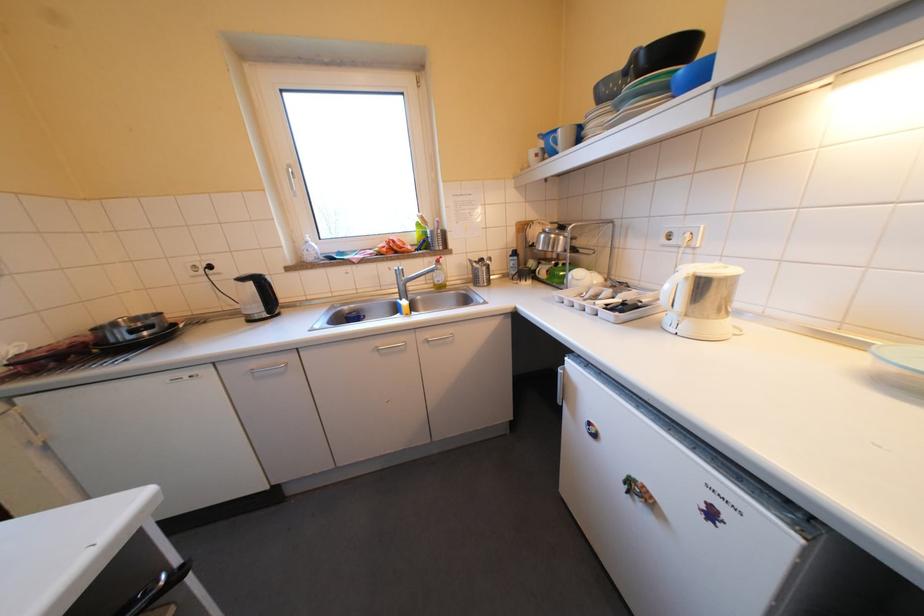
At what (x,y) coordinates should I click in order to perform the action: click on white kettle handle. Please return your answer as a coordinate pair (x, y). Image resolution: width=924 pixels, height=616 pixels. Looking at the image, I should click on (670, 291).